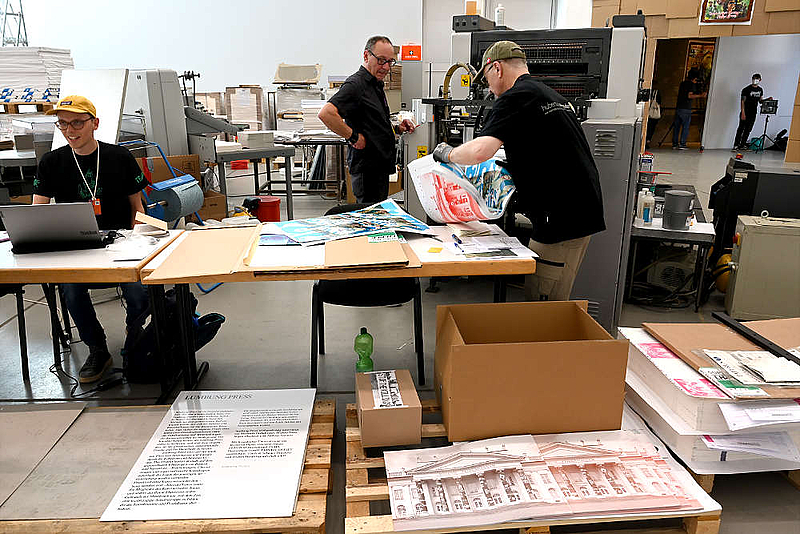
Where is `chair`? This screenshot has width=800, height=534. chair is located at coordinates (346, 300), (56, 308).